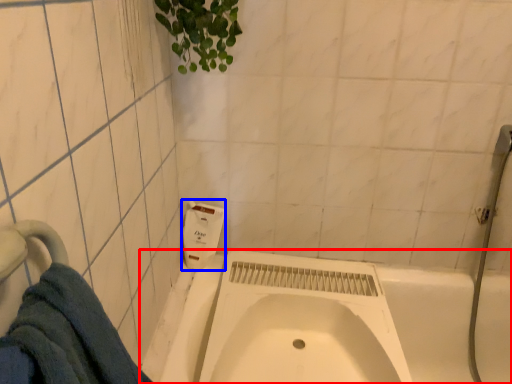
Question: Which object is closer to the camera taking this photo, bath (highlighted by a red box) or soap dispenser (highlighted by a blue box)?

Choices:
 (A) bath
 (B) soap dispenser

Answer: (A)